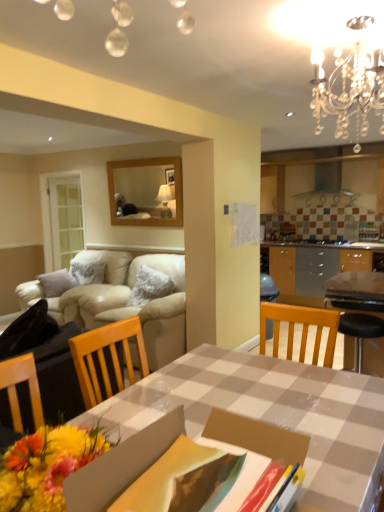
Question: From a real-world perspective, is crystal chandelier at upper right over checkerboard plastic table at center?

Choices:
 (A) yes
 (B) no

Answer: (A)

Question: Can you confirm if crystal chandelier at upper right is taller than checkerboard plastic table at center?

Choices:
 (A) no
 (B) yes

Answer: (A)

Question: Does crystal chandelier at upper right have a lesser height compared to checkerboard plastic table at center?

Choices:
 (A) yes
 (B) no

Answer: (A)

Question: Does crystal chandelier at upper right come in front of checkerboard plastic table at center?

Choices:
 (A) no
 (B) yes

Answer: (B)

Question: Is crystal chandelier at upper right looking in the opposite direction of checkerboard plastic table at center?

Choices:
 (A) no
 (B) yes

Answer: (A)

Question: Can you see crystal chandelier at upper right touching checkerboard plastic table at center?

Choices:
 (A) no
 (B) yes

Answer: (A)

Question: Is checkered fabric table at center surrounding beige leather couch at left?

Choices:
 (A) no
 (B) yes

Answer: (A)

Question: From a real-world perspective, does checkered fabric table at center sit lower than beige leather couch at left?

Choices:
 (A) yes
 (B) no

Answer: (A)

Question: Is checkered fabric table at center positioned beyond the bounds of beige leather couch at left?

Choices:
 (A) no
 (B) yes

Answer: (B)

Question: Is checkered fabric table at center beside beige leather couch at left?

Choices:
 (A) yes
 (B) no

Answer: (B)

Question: Is beige leather couch at left at the back of checkered fabric table at center?

Choices:
 (A) yes
 (B) no

Answer: (B)

Question: From the image's perspective, is checkered fabric table at center beneath beige leather couch at left?

Choices:
 (A) yes
 (B) no

Answer: (A)

Question: Is beige leather couch at left looking in the opposite direction of checkerboard plastic table at center?

Choices:
 (A) yes
 (B) no

Answer: (B)